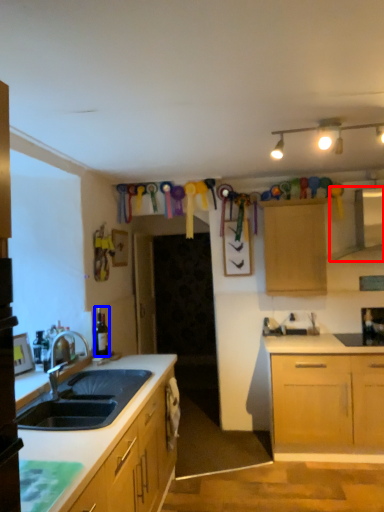
Question: Which object appears farthest to the camera in this image, exhaust hood (highlighted by a red box) or bottle (highlighted by a blue box)?

Choices:
 (A) exhaust hood
 (B) bottle

Answer: (A)